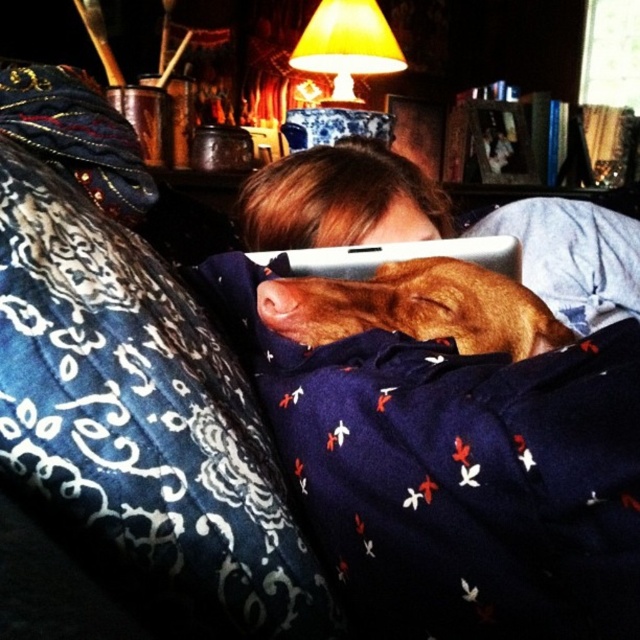
You are a delivery robot with a height of 1.5 meters. You need to navigate through the room and deliver a package to the white matte tablet at center. Can you pass under the yellow fabric lampshade at upper center without hitting your head?

The distance between the yellow fabric lampshade at upper center and the white matte tablet at center is 1.43 meters. Since the robot is 1.5 meters tall, it cannot pass under the lampshade without hitting its head because the clearance is less than its height.

You are a delivery robot that needs to place a small package between the brown furry dog at center and the white matte tablet at center. Can you fit the package in the space between them if the package is 6 inches long?

The distance between the brown furry dog at center and the white matte tablet at center is 5.71 inches. Since the package is 6 inches long, it cannot fit in the space between them as the package is slightly longer than the available space.

You are a photographer trying to capture the brown furry dog at center and the yellow fabric lampshade at upper center in a single shot. Based on their positions, will the lampshade appear above or below the dog in the photo?

The brown furry dog at center is located below the yellow fabric lampshade at upper center, so the lampshade will appear above the dog in the photo.